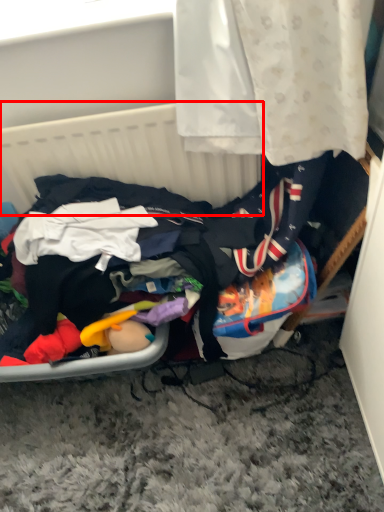
Question: Observing the image, what is the correct spatial positioning of basket (annotated by the red box) in reference to clothing?

Choices:
 (A) left
 (B) right

Answer: (A)